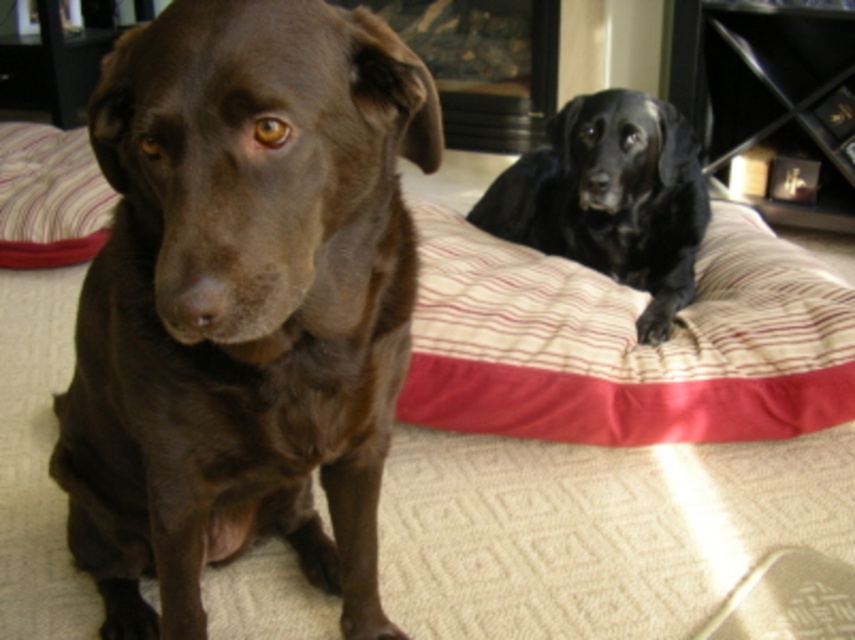
You are a dog trainer who needs to place a treat between the shiny brown dog at center and the black glossy dog at upper right. What is the minimum distance you should keep between the two dogs to ensure the treat is accessible to both?

The minimum distance between the shiny brown dog at center and the black glossy dog at upper right should be 1.07 meters to ensure the treat placed in between is accessible to both dogs.

You are a small robot with a width of 0.8 meters. You need to move from the striped fabric pillow at left to the striped fabric dog bed at right. Can you fit through the space between them?

The distance between the striped fabric dog bed at right and the striped fabric pillow at left is 1.25 meters. Since your width is 0.8 meters, you can fit through the space between them because 1.25 meters is greater than 0.8 meters.

You are a dog trainer assessing the space needed for two dogs. The shiny brown dog at center and the black glossy dog at upper right are both on a striped pet bed. Based on their sizes, which dog requires more horizontal space to lie down comfortably?

The shiny brown dog at center requires more horizontal space to lie down comfortably because its width surpasses that of the black glossy dog at upper right.